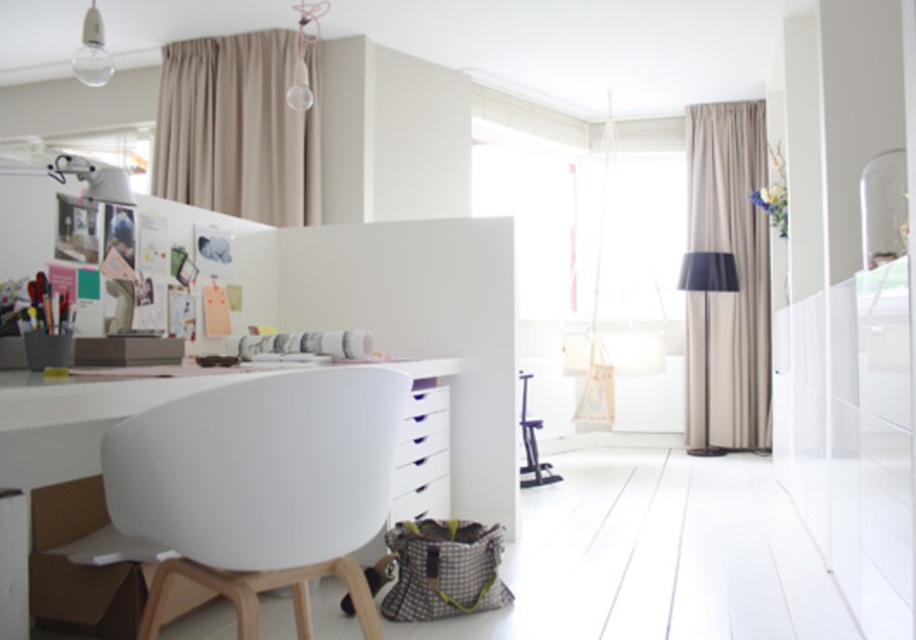
Is beige fabric curtain at right taller than metallic stool at center?

Yes, beige fabric curtain at right is taller than metallic stool at center.

Looking at this image, who is more distant from viewer, (700, 413) or (544, 476)?

The point (700, 413) is more distant.

What are the coordinates of `beige fabric curtain at right` in the screenshot? It's located at (735, 262).

Does beige fabric curtain at upper center have a larger size compared to metallic stool at center?

Yes, beige fabric curtain at upper center is bigger than metallic stool at center.

Is beige fabric curtain at upper center to the left of metallic stool at center from the viewer's perspective?

Indeed, beige fabric curtain at upper center is positioned on the left side of metallic stool at center.

Does point (241, 52) come farther from viewer compared to point (555, 476)?

No, it is in front of (555, 476).

Where is `beige fabric curtain at upper center`? beige fabric curtain at upper center is located at coordinates (237, 129).

Measure the distance from matte white lampshade at upper left to metallic stool at center.

matte white lampshade at upper left and metallic stool at center are 2.98 meters apart.

How much distance is there between matte white lampshade at upper left and metallic stool at center?

2.98 meters

Between point (69, 173) and point (532, 449), which one is positioned behind?

Point (532, 449)

You are a GUI agent. You are given a task and a screenshot of the screen. Output one action in this format:
    pyautogui.click(x=<x>, y=<y>)
    Task: Click on the matte white lampshade at upper left
    Image resolution: width=916 pixels, height=640 pixels.
    Given the screenshot: What is the action you would take?
    pyautogui.click(x=93, y=179)